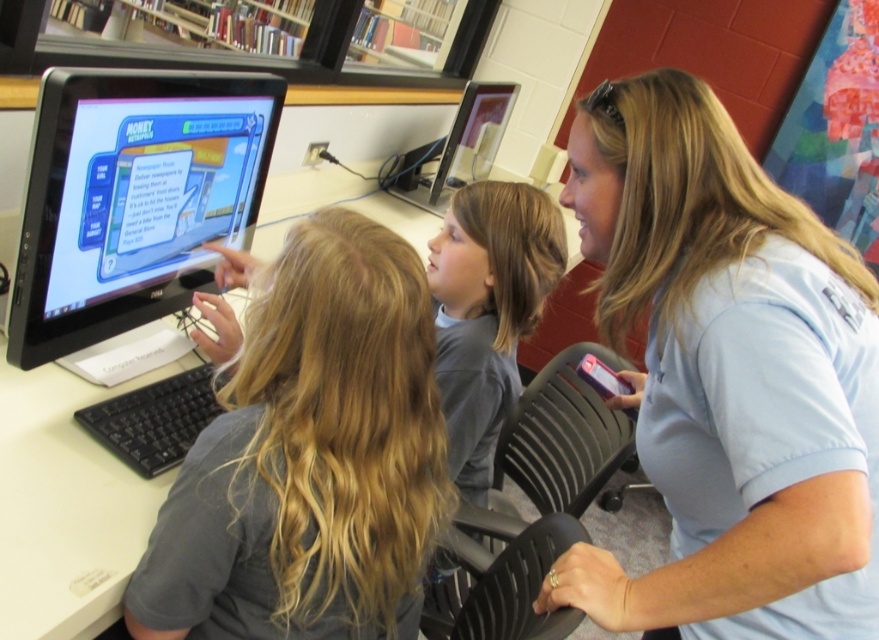
You are observing two children in the foreground of the classroom scene. Both are wearing gray shirts. The first child has a gray matte shirt at center, and the second child has a gray shirt at center. Which child has a shorter shirt?

The gray matte shirt at center is not as tall as the gray shirt at center, so the first child has a shorter shirt.